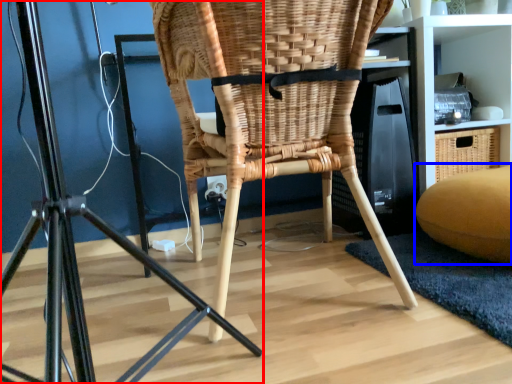
Question: Which object appears farthest to the camera in this image, furniture (highlighted by a red box) or bean bag chair (highlighted by a blue box)?

Choices:
 (A) furniture
 (B) bean bag chair

Answer: (B)